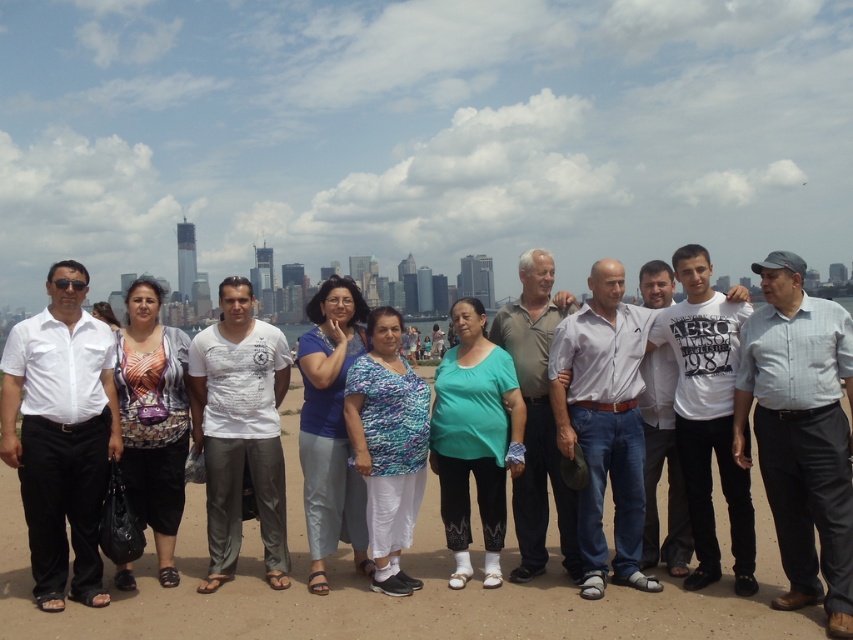
You are a photographer standing at the location where the photo was taken. You want to capture a closeup of the white cotton shirt at left. Given that your camera has a maximum zoom range of 500 meters, can you achieve this?

The white cotton shirt at left is 537.15 meters away from the viewer. Since the camera can only zoom up to 500 meters, it cannot reach the required distance. Therefore, you cannot capture a closeup of the white cotton shirt at left with this camera.

You are a photographer setting up a wide shot to include both the white cotton shirt at left and the green matte shirt at center. Based on their positions, which direction should you position your camera to ensure both are fully visible in the frame?

To ensure both the white cotton shirt at left and the green matte shirt at center are fully visible in the frame, position the camera centrally between them, slightly favoring the side with the wider subject, which is the white cotton shirt at left, to accommodate its greater width.

In the scene shown: You are a photographer trying to capture a wide shot of the group. The camera you are using has a maximum focus range of 500 feet. Can you ensure both the white cotton shirt at left and blue fabric pants at center will be in focus?

The white cotton shirt at left and blue fabric pants at center are 534.26 feet apart from each other, which exceeds the camera maximum focus range of 500 feet. Therefore, both cannot be in focus simultaneously.